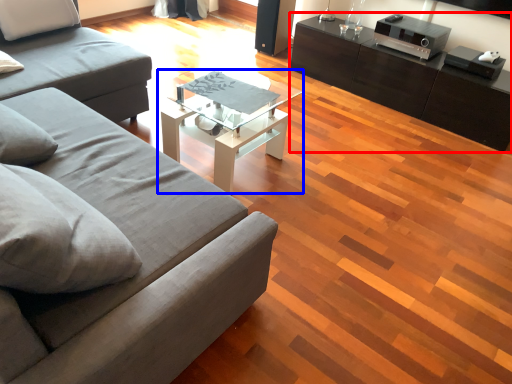
Question: Which object is further to the camera taking this photo, table (highlighted by a red box) or coffee table (highlighted by a blue box)?

Choices:
 (A) table
 (B) coffee table

Answer: (A)